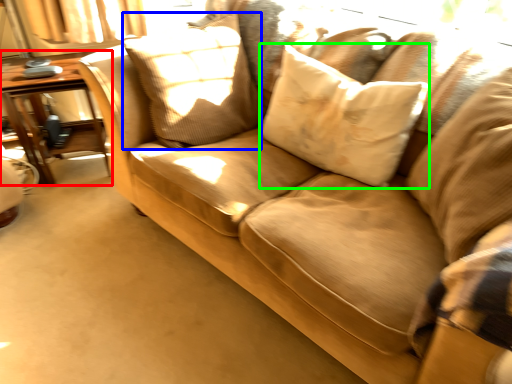
Question: Based on their relative distances, which object is nearer to table (highlighted by a red box)? Choose from pillow (highlighted by a blue box) and pillow (highlighted by a green box).

Choices:
 (A) pillow
 (B) pillow

Answer: (A)